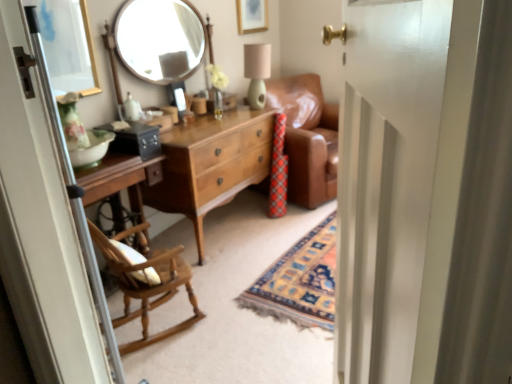
This screenshot has height=384, width=512. I want to click on gold-framed mirror at upper left, arranged as the 2th picture frame when viewed from the right, so click(x=67, y=45).

Image resolution: width=512 pixels, height=384 pixels. What do you see at coordinates (386, 180) in the screenshot?
I see `white glossy door at center, which ranks as the 2th screen door in left-to-right order` at bounding box center [386, 180].

The height and width of the screenshot is (384, 512). What are the coordinates of `light brown wood dresser at center` in the screenshot? It's located at (212, 164).

The image size is (512, 384). What do you see at coordinates (257, 72) in the screenshot?
I see `matte green lampshade at upper center` at bounding box center [257, 72].

Find the location of `gold-framed mirror at upper left, the 1th picture frame positioned from the bottom`. gold-framed mirror at upper left, the 1th picture frame positioned from the bottom is located at coordinates (67, 45).

Between matte brown coffee cup at center and white glossy door at center, which appears as the first screen door when viewed from the right, which one has larger width?

With larger width is white glossy door at center, which appears as the first screen door when viewed from the right.

Can you tell me how much matte brown coffee cup at center and white glossy door at center, which appears as the first screen door when viewed from the right, differ in facing direction?

The angle between the facing direction of matte brown coffee cup at center and the facing direction of white glossy door at center, which appears as the first screen door when viewed from the right, is 152 degrees.

Does matte brown coffee cup at center have a lesser height compared to white glossy door at center, which ranks as the 2th screen door in left-to-right order?

Indeed, matte brown coffee cup at center has a lesser height compared to white glossy door at center, which ranks as the 2th screen door in left-to-right order.

This screenshot has width=512, height=384. I want to click on coffee cup behind the white glossy door at center, which appears as the first screen door when viewed from the right, so click(x=199, y=105).

Is white glossy door at center, which ranks as the 2th screen door in left-to-right order, inside light brown wood dresser at center?

That's incorrect, white glossy door at center, which ranks as the 2th screen door in left-to-right order, is not inside light brown wood dresser at center.

Where is `screen door on the right of light brown wood dresser at center`? This screenshot has height=384, width=512. screen door on the right of light brown wood dresser at center is located at coordinates (386, 180).

Is light brown wood dresser at center positioned far away from white glossy door at center, which ranks as the 2th screen door in left-to-right order?

Indeed, light brown wood dresser at center is not near white glossy door at center, which ranks as the 2th screen door in left-to-right order.

Does light brown wood dresser at center appear on the left side of white glossy door at center, which appears as the first screen door when viewed from the right?

Yes, light brown wood dresser at center is to the left of white glossy door at center, which appears as the first screen door when viewed from the right.

From the picture: Is matte brown coffee cup at center positioned behind matte green lampshade at upper center?

Yes, it is behind matte green lampshade at upper center.

Which object is wider, matte brown coffee cup at center or matte green lampshade at upper center?

Wider between the two is matte green lampshade at upper center.

Would you say matte brown coffee cup at center is outside matte green lampshade at upper center?

Yes, matte brown coffee cup at center is located beyond the bounds of matte green lampshade at upper center.

From a real-world perspective, between matte brown coffee cup at center and matte green lampshade at upper center, who is vertically higher?

In real-world perspective, matte green lampshade at upper center is above.

In terms of width, does white glossy door at center, which appears as the first screen door when viewed from the right, look wider or thinner when compared to matte brown coffee cup at center?

Clearly, white glossy door at center, which appears as the first screen door when viewed from the right, has more width compared to matte brown coffee cup at center.

Could you tell me if white glossy door at center, which ranks as the 2th screen door in left-to-right order, is turned towards matte brown coffee cup at center?

No, white glossy door at center, which ranks as the 2th screen door in left-to-right order, is not facing towards matte brown coffee cup at center.

From the matte brown coffee cup at center, count 2nd screen doors forward and point to it. Please provide its 2D coordinates.

[(386, 180)]

Does white glossy door at center, which ranks as the 2th screen door in left-to-right order, appear on the right side of matte brown coffee cup at center?

Indeed, white glossy door at center, which ranks as the 2th screen door in left-to-right order, is positioned on the right side of matte brown coffee cup at center.

In order to click on the 1st picture frame directly above the wooden rocking chair at left (from a real-world perspective) in this screenshot , I will do `click(67, 45)`.

Consider the image. Which is behind, gold-framed mirror at upper left, which is counted as the 2th picture frame, starting from the back, or wooden rocking chair at left?

gold-framed mirror at upper left, which is counted as the 2th picture frame, starting from the back, is more distant.

Which object is wider, gold-framed mirror at upper left, which is counted as the 2th picture frame, starting from the back, or wooden rocking chair at left?

Wider between the two is wooden rocking chair at left.

From the image's perspective, is gold-framed mirror at upper left, acting as the 2th picture frame starting from the top, beneath wooden rocking chair at left?

Incorrect, from the image's perspective, gold-framed mirror at upper left, acting as the 2th picture frame starting from the top, is higher than wooden rocking chair at left.

From a real-world perspective, which is physically above, white glossy door at center, which appears as the first screen door when viewed from the right, or light brown wood dresser at center?

In real-world perspective, white glossy door at center, which appears as the first screen door when viewed from the right, is above.

Image resolution: width=512 pixels, height=384 pixels. Find the location of `cabinetry behind the white glossy door at center, which ranks as the 2th screen door in left-to-right order`. cabinetry behind the white glossy door at center, which ranks as the 2th screen door in left-to-right order is located at coordinates (212, 164).

From the image's perspective, is white glossy door at center, which ranks as the 2th screen door in left-to-right order, on top of light brown wood dresser at center?

No, from the image's perspective, white glossy door at center, which ranks as the 2th screen door in left-to-right order, is not above light brown wood dresser at center.

Does white glossy door at center, which ranks as the 2th screen door in left-to-right order, touch light brown wood dresser at center?

No, white glossy door at center, which ranks as the 2th screen door in left-to-right order, is not next to light brown wood dresser at center.

Is wooden rocking chair at left positioned far away from white glossy door at center, which appears as the first screen door when viewed from the right?

Yes, wooden rocking chair at left and white glossy door at center, which appears as the first screen door when viewed from the right, are quite far apart.

Is point (124, 318) positioned in front of point (384, 42)?

No.

Measure the distance between wooden rocking chair at left and white glossy door at center, which appears as the first screen door when viewed from the right.

3.60 feet.

Considering the relative sizes of wooden rocking chair at left and white glossy door at center, which ranks as the 2th screen door in left-to-right order, in the image provided, is wooden rocking chair at left smaller than white glossy door at center, which ranks as the 2th screen door in left-to-right order,?

Yes.

Image resolution: width=512 pixels, height=384 pixels. What are the coordinates of `coffee cup above the white glossy door at center, which appears as the first screen door when viewed from the right (from a real-world perspective)` in the screenshot? It's located at (199, 105).

You are a GUI agent. You are given a task and a screenshot of the screen. Output one action in this format:
    pyautogui.click(x=<x>, y=<y>)
    Task: Click on the screen door that appears on the right of light brown wood dresser at center
    
    Given the screenshot: What is the action you would take?
    pyautogui.click(x=386, y=180)

Which object lies nearer to the anchor point matte green lampshade at upper center, gold-framed mirror at upper left, the first picture frame positioned from the left, or light brown wood dresser at center?

Among the two, light brown wood dresser at center is located nearer to matte green lampshade at upper center.

Looking at the image, which one is located closer to gold-framed mirror at upper left, which is counted as the 1th picture frame, starting from the front, wooden rocking chair at left or light brown wood dresser at center?

light brown wood dresser at center lies closer to gold-framed mirror at upper left, which is counted as the 1th picture frame, starting from the front, than the other object.

Which object lies further to the anchor point gold-framed mirror at upper left, arranged as the 2th picture frame when viewed from the right, light brown wood dresser at center or wooden screen door at left, which is the 1th screen door from left to right?

wooden screen door at left, which is the 1th screen door from left to right, is further to gold-framed mirror at upper left, arranged as the 2th picture frame when viewed from the right.

When comparing their distances from gold-framed picture at upper center, which ranks as the 2th picture frame in left-to-right order, does light brown wood dresser at center or matte brown coffee cup at center seem closer?

matte brown coffee cup at center.

Based on their spatial positions, is matte green lampshade at upper center or gold-framed mirror at upper left, the 1th picture frame positioned from the bottom, closer to wooden rocking chair at left?

The object closer to wooden rocking chair at left is gold-framed mirror at upper left, the 1th picture frame positioned from the bottom.

From the image, which object appears to be farther from wooden screen door at left, the 2th screen door from the right, light brown wood dresser at center or matte brown coffee cup at center?

Based on the image, matte brown coffee cup at center appears to be further to wooden screen door at left, the 2th screen door from the right.

When comparing their distances from light brown wood dresser at center, does gold-framed picture at upper center, the first picture frame positioned from the top, or matte white vase at center seem further?

The object further to light brown wood dresser at center is gold-framed picture at upper center, the first picture frame positioned from the top.

From the image, which object appears to be farther from matte green lampshade at upper center, matte white vase at center or white glossy door at center, which ranks as the 2th screen door in left-to-right order?

white glossy door at center, which ranks as the 2th screen door in left-to-right order, is positioned further to the anchor matte green lampshade at upper center.

Where is `lamp between gold-framed picture at upper center, arranged as the second picture frame when ordered from the bottom, and matte white vase at center in the up-down direction`? lamp between gold-framed picture at upper center, arranged as the second picture frame when ordered from the bottom, and matte white vase at center in the up-down direction is located at coordinates (257, 72).

Find the location of a particular element. Image resolution: width=512 pixels, height=384 pixels. cabinetry between gold-framed mirror at upper left, the 1th picture frame positioned from the bottom, and wooden rocking chair at left from top to bottom is located at coordinates (212, 164).

Locate an element on the screen. This screenshot has height=384, width=512. coffee cup between white glossy door at center, which ranks as the 2th screen door in left-to-right order, and gold-framed picture at upper center, which ranks as the 2th picture frame in left-to-right order, in the front-back direction is located at coordinates (199, 105).

Image resolution: width=512 pixels, height=384 pixels. In order to click on bottle located between gold-framed mirror at upper left, which is counted as the 2th picture frame, starting from the back, and matte green lampshade at upper center in the left-right direction in this screenshot , I will do `click(132, 109)`.